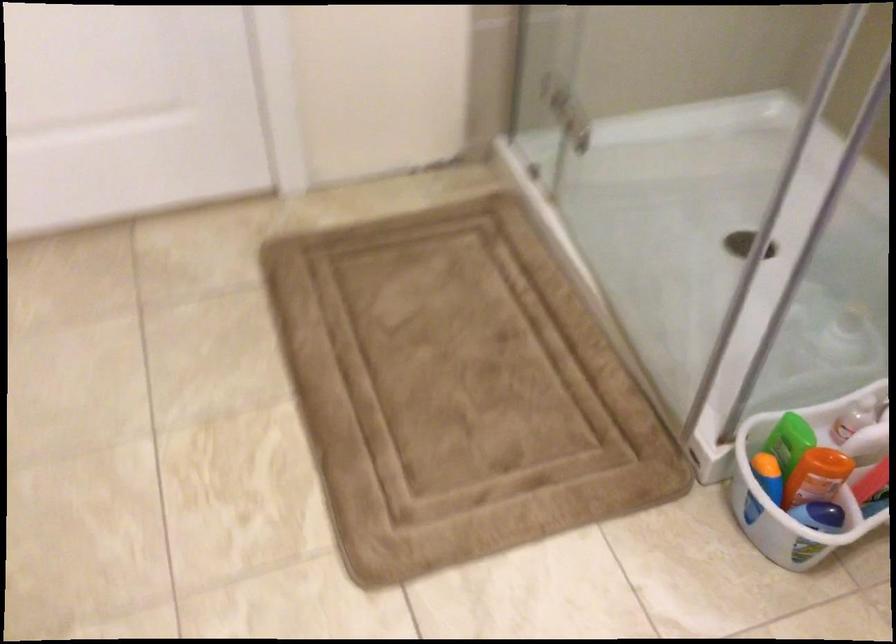
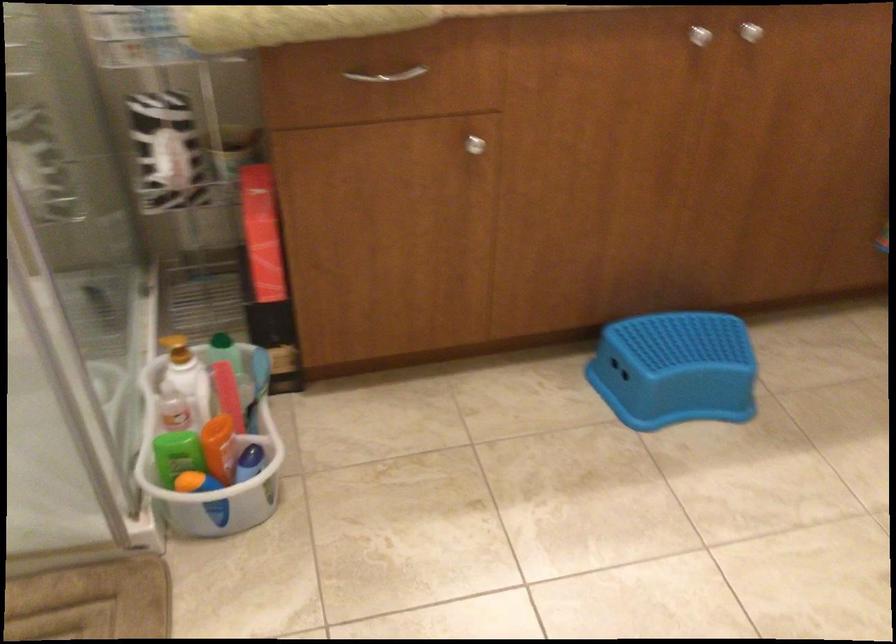
Find the pixel in the second image that matches (x=796, y=440) in the first image.

(177, 453)